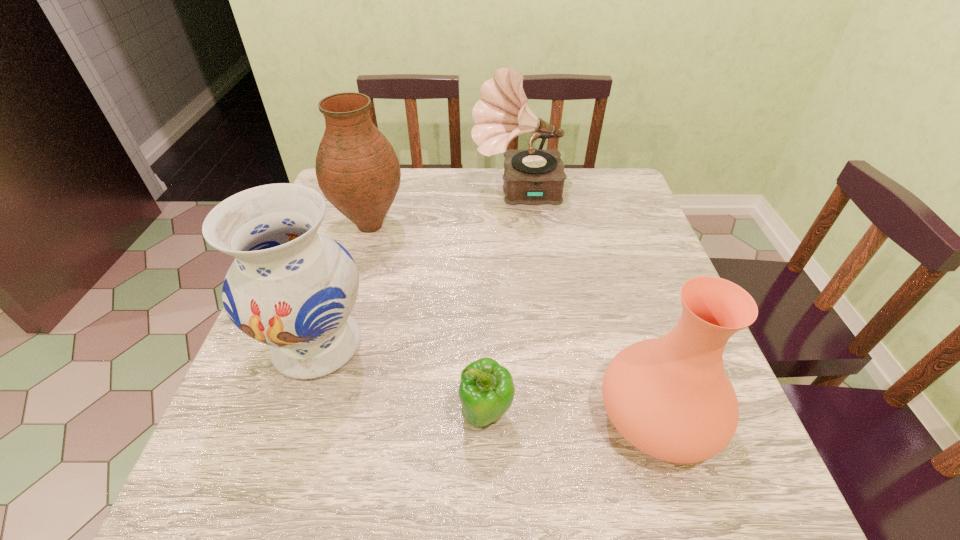
Locate an element on the screen. This screenshot has height=540, width=960. free space at the near left corner of the desktop is located at coordinates (256, 476).

What are the coordinates of `vacant region at the far right corner of the desktop` in the screenshot? It's located at (617, 182).

What are the coordinates of `vacant region at the near right corner` in the screenshot? It's located at (769, 492).

I want to click on free space between the record player and the rightmost vase, so click(588, 304).

You are a GUI agent. You are given a task and a screenshot of the screen. Output one action in this format:
    pyautogui.click(x=<x>, y=<y>)
    Task: Click on the free spot between the rightmost vase and the farthest vase
    Image resolution: width=960 pixels, height=540 pixels.
    Given the screenshot: What is the action you would take?
    pyautogui.click(x=514, y=321)

In order to click on vacant space in between the record player and the rightmost vase in this screenshot , I will do `click(588, 304)`.

I want to click on free space between the rightmost vase and the record player, so click(x=588, y=304).

Where is `vacant space in between the rightmost vase and the farthest vase`? Image resolution: width=960 pixels, height=540 pixels. vacant space in between the rightmost vase and the farthest vase is located at coordinates (514, 321).

Where is `vacant point located between the rightmost vase and the farthest vase`? Image resolution: width=960 pixels, height=540 pixels. vacant point located between the rightmost vase and the farthest vase is located at coordinates (514, 321).

Locate an element on the screen. This screenshot has width=960, height=540. the fourth closest object to the bell pepper is located at coordinates (532, 176).